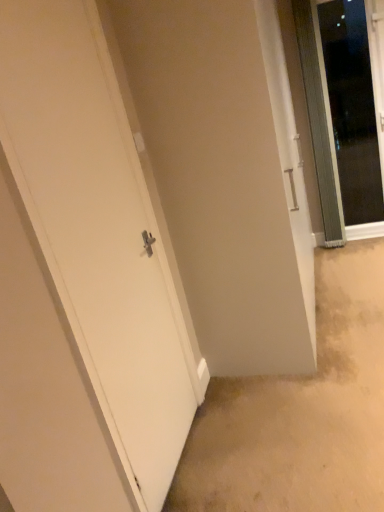
Question: Relative to white matte door at left, placed as the 1th door when sorted from front to back, is transparent glass door at upper right, the 2th door positioned from the front, in front or behind?

Choices:
 (A) behind
 (B) front

Answer: (A)

Question: From the image's perspective, is transparent glass door at upper right, which is counted as the 2th door, starting from the left, above or below white matte door at left, the second door when ordered from right to left?

Choices:
 (A) below
 (B) above

Answer: (B)

Question: Is transparent glass door at upper right, which is counted as the 2th door, starting from the left, taller or shorter than white matte door at left, the first door from the left?

Choices:
 (A) tall
 (B) short

Answer: (B)

Question: Considering the positions of point (157, 487) and point (350, 31), is point (157, 487) closer or farther from the camera than point (350, 31)?

Choices:
 (A) farther
 (B) closer

Answer: (B)

Question: From the image's perspective, is white matte door at left, the second door when ordered from right to left, above or below transparent glass door at upper right, the 2th door positioned from the front?

Choices:
 (A) above
 (B) below

Answer: (B)

Question: From their relative heights in the image, would you say white matte door at left, placed as the 1th door when sorted from front to back, is taller or shorter than transparent glass door at upper right, the 2th door positioned from the front?

Choices:
 (A) short
 (B) tall

Answer: (B)

Question: Would you say white matte door at left, which ranks as the 2th door in back-to-front order, is inside or outside transparent glass door at upper right, marked as the first door in a right-to-left arrangement?

Choices:
 (A) inside
 (B) outside

Answer: (B)